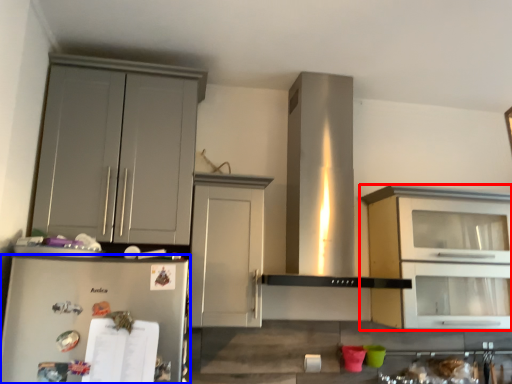
Question: Among these objects, which one is farthest to the camera, cabinetry (highlighted by a red box) or refrigerator (highlighted by a blue box)?

Choices:
 (A) cabinetry
 (B) refrigerator

Answer: (A)